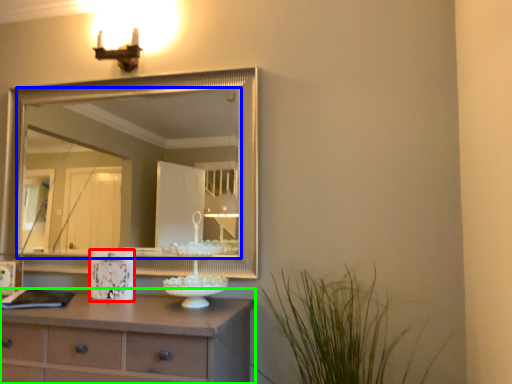
Question: Considering the real-world distances, which object is farthest from picture frame (highlighted by a red box)? mirror (highlighted by a blue box) or chest of drawers (highlighted by a green box)?

Choices:
 (A) mirror
 (B) chest of drawers

Answer: (A)